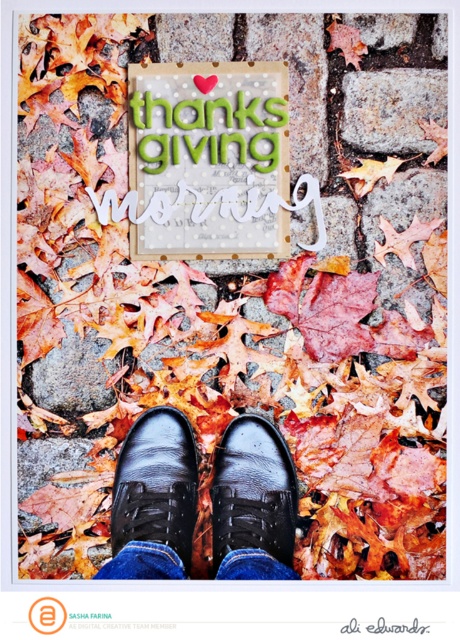
You are standing in a room and see the black leather shoes at center and the black leather shoe at center. Which one is placed lower?

The black leather shoes at center is placed lower than the black leather shoe at center.

You are a delivery person who needs to place a matte cardboard sign at center and a black leather shoe at center on a shelf. The shelf has limited space. Which object should you place first to ensure both fit properly?

The matte cardboard sign at center should be placed first since it is positioned on the right side of the black leather shoe at center, meaning it requires less space on the right side of the shelf to accommodate both items.

You are trying to decide which shoe to wear for a casual autumn walk. You have a black leather shoe at center and a glossy leather shoe at center. Based on their sizes, which one would be more comfortable for walking long distances?

The black leather shoe at center is bigger than the glossy leather shoe at center, so it would likely be more comfortable for walking long distances as larger shoes can accommodate more foot movement and provide better support.